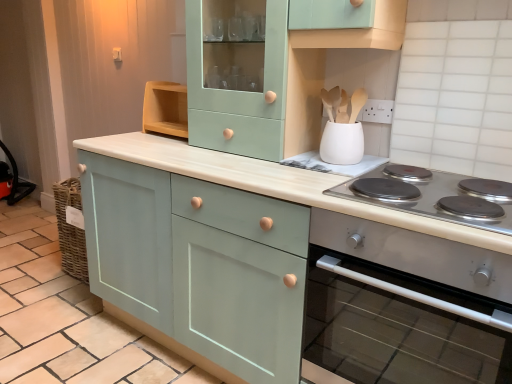
Question: Can you confirm if white matte utensil holder at upper center is wider than silver metallic cooktop at lower right?

Choices:
 (A) yes
 (B) no

Answer: (B)

Question: Does white matte utensil holder at upper center have a larger size compared to silver metallic cooktop at lower right?

Choices:
 (A) yes
 (B) no

Answer: (B)

Question: Could you tell me if white matte utensil holder at upper center is turned towards silver metallic cooktop at lower right?

Choices:
 (A) no
 (B) yes

Answer: (A)

Question: Is white matte utensil holder at upper center further to camera compared to silver metallic cooktop at lower right?

Choices:
 (A) no
 (B) yes

Answer: (B)

Question: Would you say white matte utensil holder at upper center contains silver metallic cooktop at lower right?

Choices:
 (A) yes
 (B) no

Answer: (B)

Question: In the image, is matte green cabinet at center, acting as the 1th cabinetry starting from the right, on the left side or the right side of matte teal cabinet at center, arranged as the 3th cabinetry when viewed from the right?

Choices:
 (A) right
 (B) left

Answer: (A)

Question: Based on their sizes in the image, would you say matte green cabinet at center, which is the 3th cabinetry from left to right, is bigger or smaller than matte teal cabinet at center, placed as the 1th cabinetry when sorted from left to right?

Choices:
 (A) big
 (B) small

Answer: (A)

Question: Which is correct: matte green cabinet at center, which is the 3th cabinetry from left to right, is inside matte teal cabinet at center, placed as the 1th cabinetry when sorted from left to right, or outside of it?

Choices:
 (A) inside
 (B) outside

Answer: (B)

Question: In the image, is matte green cabinet at center, which is the 3th cabinetry from left to right, positioned in front of or behind matte teal cabinet at center, placed as the 1th cabinetry when sorted from left to right?

Choices:
 (A) behind
 (B) front

Answer: (B)

Question: Considering the positions of mint green wood cabinet at upper center, acting as the 2th cabinetry starting from the left, and satin silver oven at right in the image, is mint green wood cabinet at upper center, acting as the 2th cabinetry starting from the left, wider or thinner than satin silver oven at right?

Choices:
 (A) wide
 (B) thin

Answer: (B)

Question: Is mint green wood cabinet at upper center, which appears as the second cabinetry when viewed from the right, taller or shorter than satin silver oven at right?

Choices:
 (A) tall
 (B) short

Answer: (A)

Question: Would you say mint green wood cabinet at upper center, which appears as the second cabinetry when viewed from the right, is to the left or to the right of satin silver oven at right in the picture?

Choices:
 (A) left
 (B) right

Answer: (A)

Question: Considering the positions of point (312, 82) and point (502, 370), is point (312, 82) closer or farther from the camera than point (502, 370)?

Choices:
 (A) farther
 (B) closer

Answer: (A)

Question: In the image, is matte teal cabinet at center, arranged as the 3th cabinetry when viewed from the right, on the left side or the right side of matte green cabinet at center, acting as the 1th cabinetry starting from the right?

Choices:
 (A) left
 (B) right

Answer: (A)

Question: From a real-world perspective, is matte teal cabinet at center, arranged as the 3th cabinetry when viewed from the right, physically located above or below matte green cabinet at center, acting as the 1th cabinetry starting from the right?

Choices:
 (A) below
 (B) above

Answer: (A)